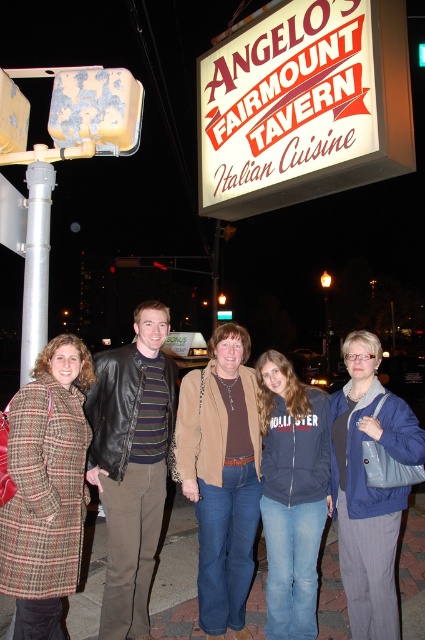
Is white plastic sign at upper center to the left of brown suede jacket at center from the viewer's perspective?

Incorrect, white plastic sign at upper center is not on the left side of brown suede jacket at center.

Who is more distant from viewer, (303, 13) or (195, 384)?

Positioned behind is point (195, 384).

Where is `white plastic sign at upper center`? The height and width of the screenshot is (640, 425). white plastic sign at upper center is located at coordinates (303, 106).

Can you confirm if leather jacket at center is taller than brown suede jacket at center?

Yes.

Describe the element at coordinates (132, 465) in the screenshot. The image size is (425, 640). I see `leather jacket at center` at that location.

Between point (96, 419) and point (221, 326), which one is positioned in front?

Point (96, 419) is more forward.

Identify the location of leather jacket at center. This screenshot has height=640, width=425. [x=132, y=465].

Can you confirm if brown suede jacket at center is positioned above blue fabric jacket at lower right?

No, brown suede jacket at center is not above blue fabric jacket at lower right.

Image resolution: width=425 pixels, height=640 pixels. Describe the element at coordinates (221, 476) in the screenshot. I see `brown suede jacket at center` at that location.

Where is `brown suede jacket at center`? The image size is (425, 640). brown suede jacket at center is located at coordinates (221, 476).